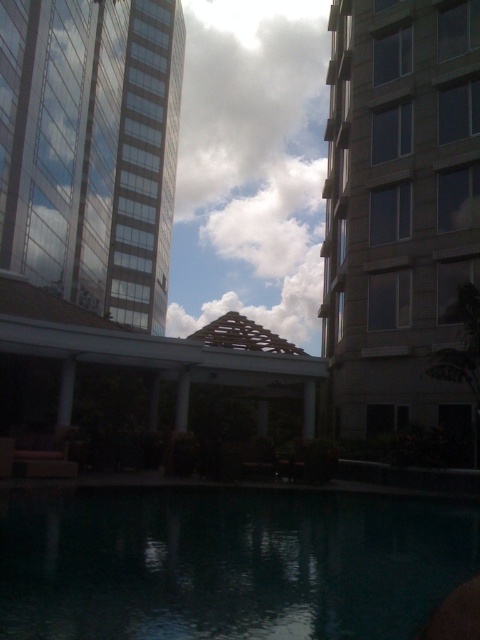
Question: Estimate the real-world distances between objects in this image. Which object is closer to the clear glass pool at center?

Choices:
 (A) cloudy sky at center
 (B) gray concrete building at right
 (C) glassy reflective building at upper left

Answer: (B)

Question: Does cloudy sky at center have a larger size compared to white fluffy cloud at center?

Choices:
 (A) yes
 (B) no

Answer: (A)

Question: Which object is positioned farthest from the white fluffy cloud at upper center?

Choices:
 (A) glassy reflective building at upper left
 (B) clear glass pool at center
 (C) gray concrete building at right
 (D) white fluffy cloud at center

Answer: (B)

Question: Which point is closer to the camera?

Choices:
 (A) (394, 202)
 (B) (247, 536)
 (C) (199, 259)

Answer: (B)

Question: Observing the image, what is the correct spatial positioning of gray concrete building at right in reference to cloudy sky at center?

Choices:
 (A) left
 (B) right

Answer: (B)

Question: Is clear glass pool at center thinner than white fluffy cloud at upper center?

Choices:
 (A) no
 (B) yes

Answer: (B)